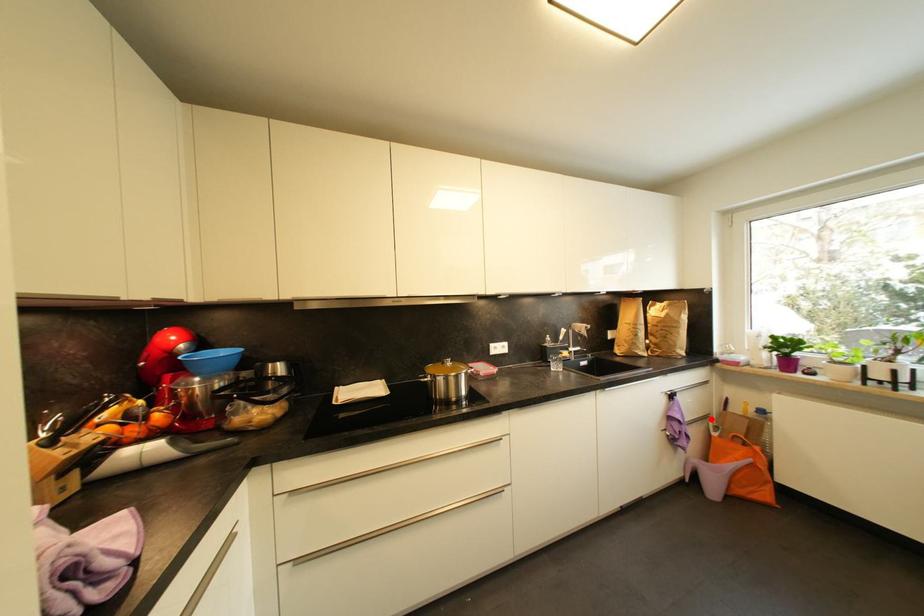
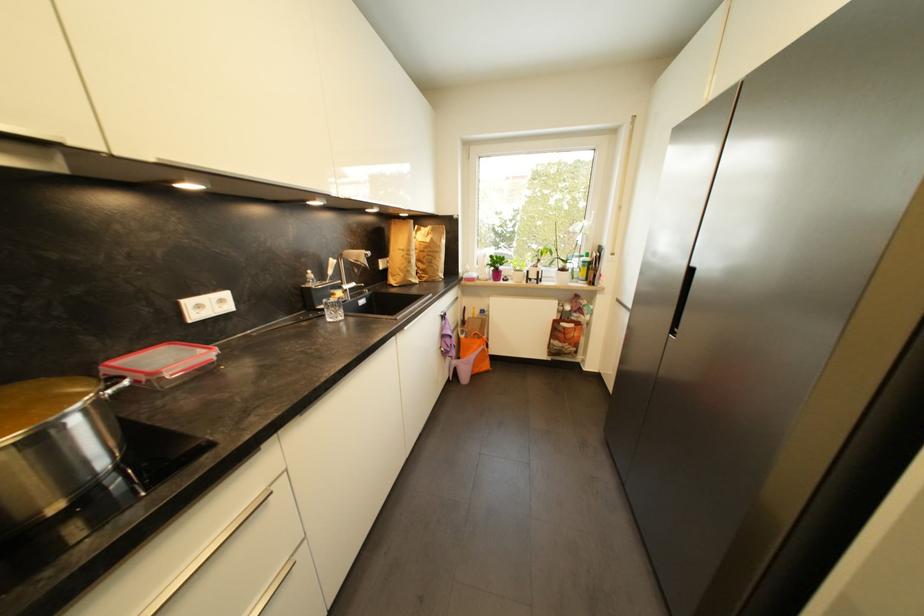
In the second image, find the point that corresponds to the highlighted location in the first image.

(463, 328)